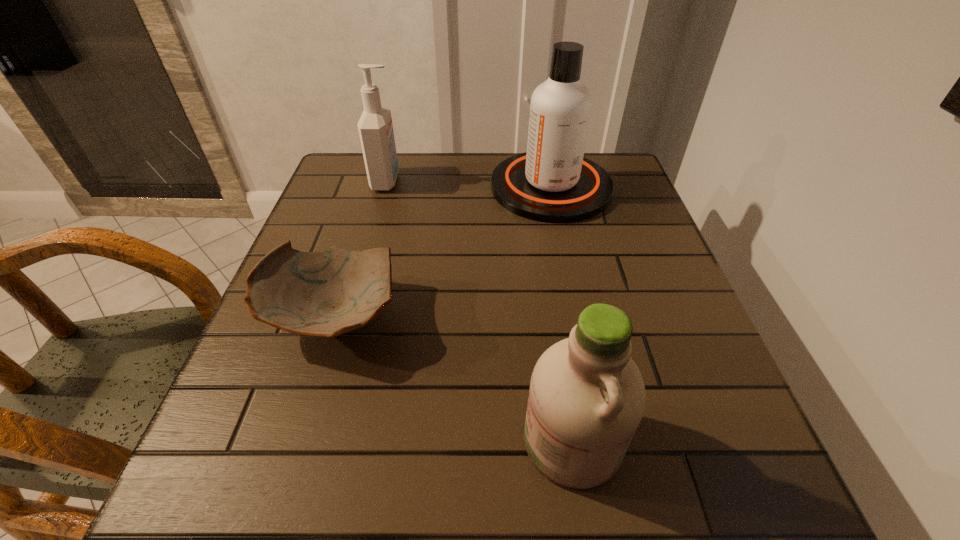
Identify the location of cleansing agent that is the second closest one to the nearest cleansing agent. (375, 127).

Where is `cleansing agent that is the second nearest to the shortest object`? This screenshot has width=960, height=540. cleansing agent that is the second nearest to the shortest object is located at coordinates (552, 182).

You are a GUI agent. You are given a task and a screenshot of the screen. Output one action in this format:
    pyautogui.click(x=<x>, y=<y>)
    Task: Click on the vacant region that satisfies the following two spatial constraints: 1. on the front label of the leftmost cleansing agent; 2. on the front side of the shortest object
    The width and height of the screenshot is (960, 540).
    Given the screenshot: What is the action you would take?
    pyautogui.click(x=348, y=318)